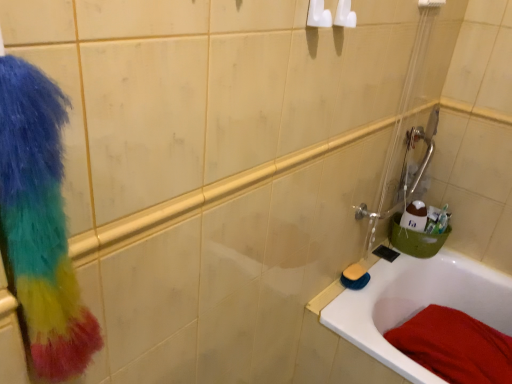
Question: Does yellow sponge at lower right have a larger size compared to red cotton towel at lower right?

Choices:
 (A) no
 (B) yes

Answer: (A)

Question: Is red cotton towel at lower right a part of yellow sponge at lower right?

Choices:
 (A) yes
 (B) no

Answer: (B)

Question: Can you confirm if yellow sponge at lower right is smaller than red cotton towel at lower right?

Choices:
 (A) yes
 (B) no

Answer: (A)

Question: Is yellow sponge at lower right shorter than red cotton towel at lower right?

Choices:
 (A) no
 (B) yes

Answer: (B)

Question: Is yellow sponge at lower right closer to camera compared to red cotton towel at lower right?

Choices:
 (A) yes
 (B) no

Answer: (B)

Question: Is yellow sponge at lower right in front of or behind white glossy bathtub at lower right in the image?

Choices:
 (A) front
 (B) behind

Answer: (B)

Question: Which is correct: yellow sponge at lower right is inside white glossy bathtub at lower right, or outside of it?

Choices:
 (A) inside
 (B) outside

Answer: (B)

Question: From their relative heights in the image, would you say yellow sponge at lower right is taller or shorter than white glossy bathtub at lower right?

Choices:
 (A) short
 (B) tall

Answer: (A)

Question: Considering the positions of point (366, 273) and point (403, 364), is point (366, 273) closer or farther from the camera than point (403, 364)?

Choices:
 (A) closer
 (B) farther

Answer: (B)

Question: From the image's perspective, is green plastic bucket at right located above or below multicolored fluffy scrub at left?

Choices:
 (A) above
 (B) below

Answer: (B)

Question: Considering the positions of green plastic bucket at right and multicolored fluffy scrub at left in the image, is green plastic bucket at right wider or thinner than multicolored fluffy scrub at left?

Choices:
 (A) wide
 (B) thin

Answer: (A)

Question: Visually, is green plastic bucket at right positioned to the left or to the right of multicolored fluffy scrub at left?

Choices:
 (A) left
 (B) right

Answer: (B)

Question: From a real-world perspective, is green plastic bucket at right positioned above or below multicolored fluffy scrub at left?

Choices:
 (A) below
 (B) above

Answer: (A)

Question: Considering the positions of red cotton towel at lower right and yellow sponge at lower right in the image, is red cotton towel at lower right wider or thinner than yellow sponge at lower right?

Choices:
 (A) thin
 (B) wide

Answer: (B)

Question: From a real-world perspective, relative to yellow sponge at lower right, is red cotton towel at lower right vertically above or below?

Choices:
 (A) below
 (B) above

Answer: (A)